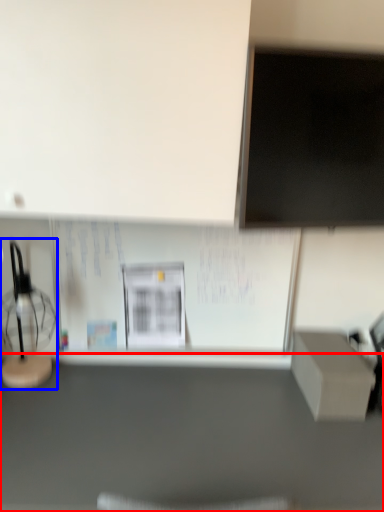
Question: Which object appears farthest to the camera in this image, furniture (highlighted by a red box) or table lamp (highlighted by a blue box)?

Choices:
 (A) furniture
 (B) table lamp

Answer: (B)